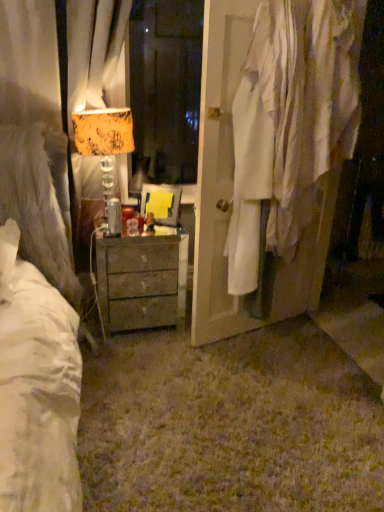
The height and width of the screenshot is (512, 384). I want to click on vacant region in front of rustic wood chest of drawers at center, so click(x=137, y=361).